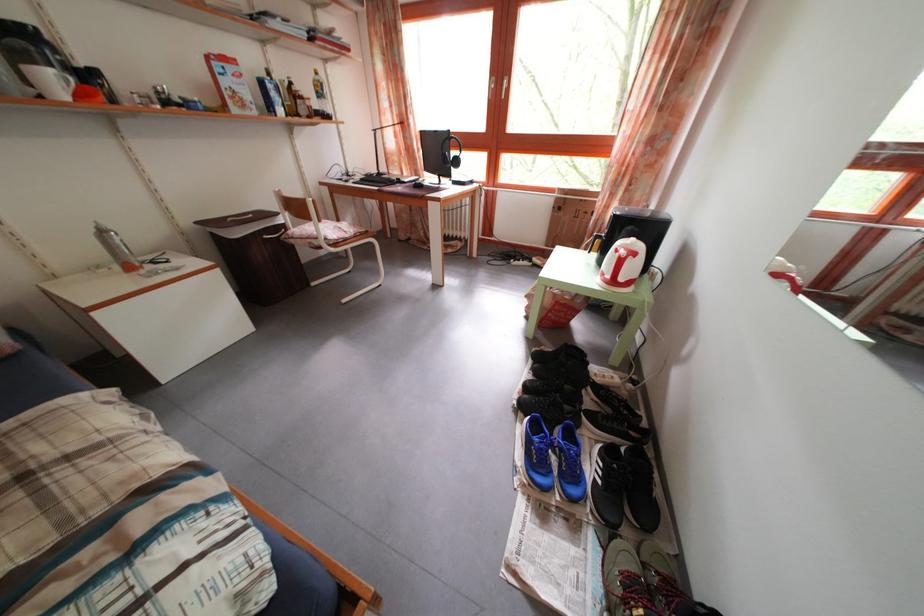
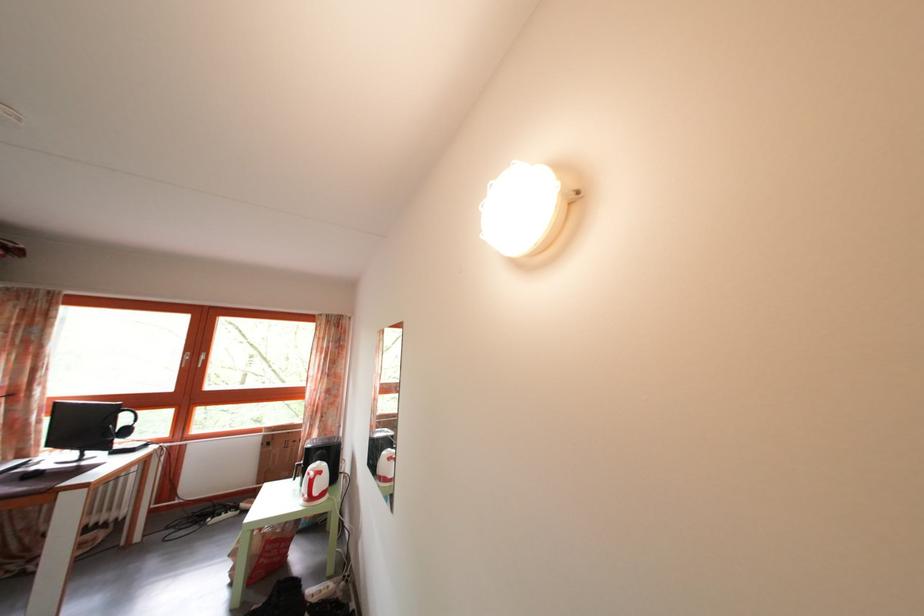
In the second image, find the point that corresponds to [557,318] in the first image.

(268, 562)